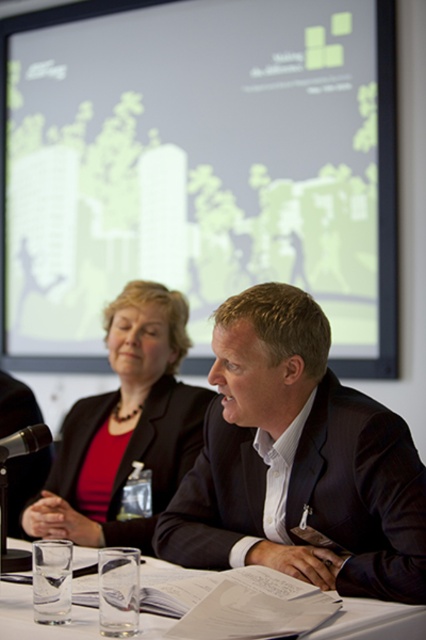
What are the coordinates of the dark suit at center?

The dark suit at center is located at coordinates point (296, 460).

You are a photographer standing at the back of the room. You want to take a photo of the dark suit at center from a distance that allows you to capture it clearly without distortion. Given that the minimum focus distance for your camera is 1.5 meters, will you need to move closer or farther away?

The dark suit at center is 1.43 meters away from the camera, which is closer than the minimum focus distance of 1.5 meters. Therefore, you need to move slightly farther away to ensure the camera can focus properly.

You are organizing a small event and need to place a decorative plate between the matte black blazer at center and the black plastic microphone at left. Based on their sizes, which object should the plate be closer to?

The matte black blazer at center might be wider than black plastic microphone at left, so the plate should be placed closer to the black plastic microphone at left to balance the width difference.